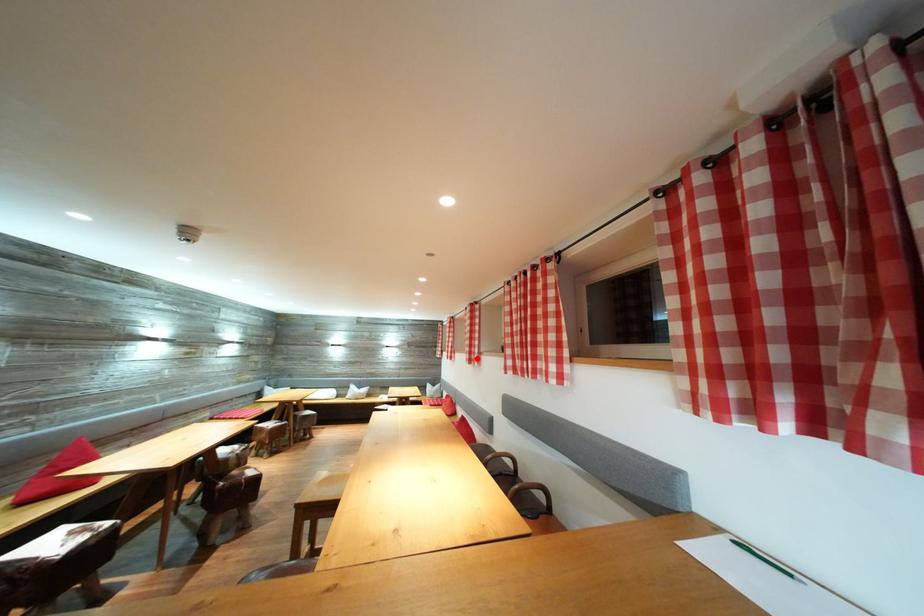
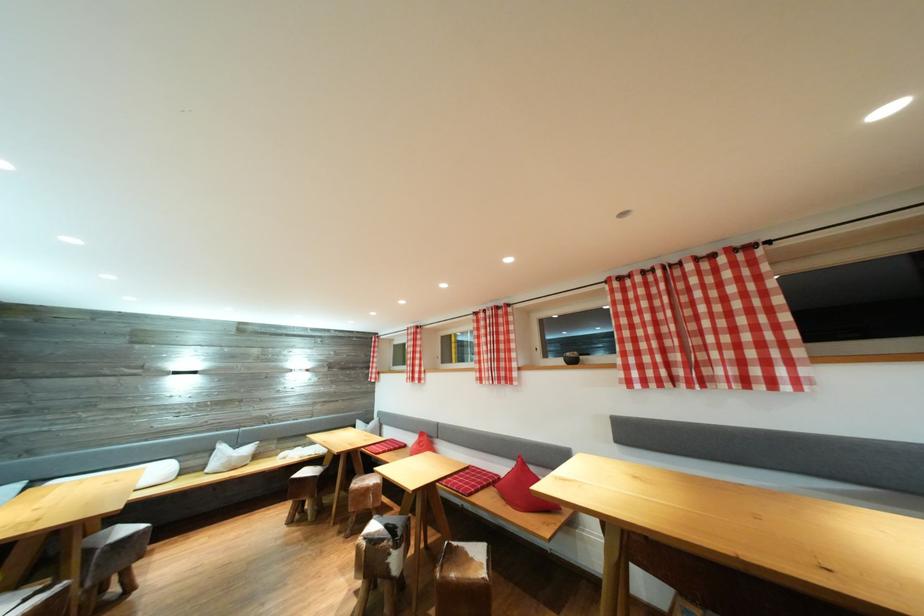
In the second image, find the point that corresponds to the highlighted location in the first image.

(505, 374)